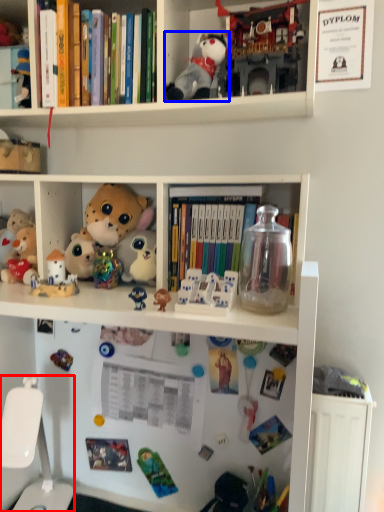
Question: Which object appears closest to the camera in this image, swivel chair (highlighted by a red box) or toy (highlighted by a blue box)?

Choices:
 (A) swivel chair
 (B) toy

Answer: (A)